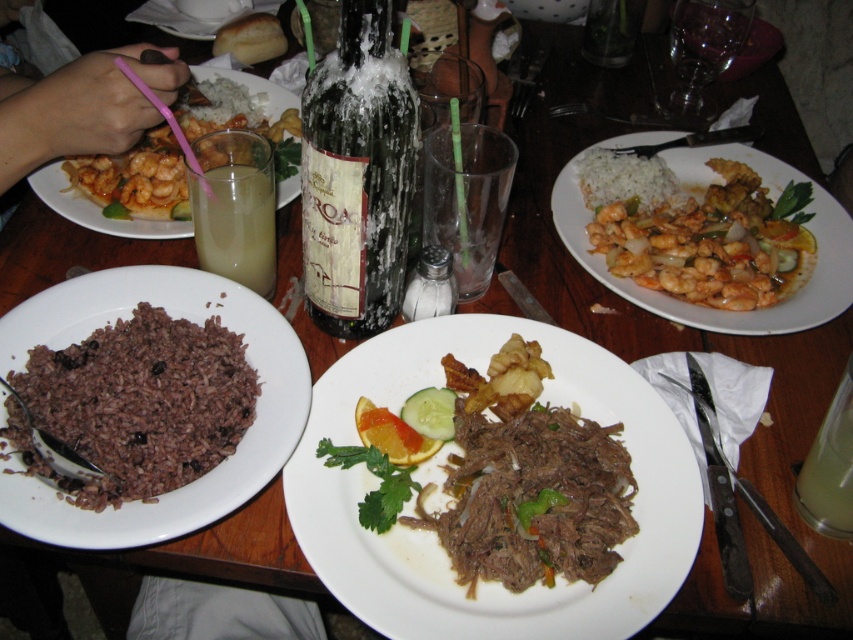
Can you confirm if shiny orange shrimp at upper left is bigger than bread at center?

Yes, shiny orange shrimp at upper left is bigger than bread at center.

Based on the photo, is shiny orange shrimp at upper left positioned before bread at center?

Yes, it is in front of bread at center.

Is point (279, 106) less distant than point (271, 36)?

Yes, it is in front of point (271, 36).

Where is `shiny orange shrimp at upper left`? shiny orange shrimp at upper left is located at coordinates (135, 177).

The height and width of the screenshot is (640, 853). In order to click on dark glass bottle at center in this screenshot , I will do `click(357, 176)`.

From the picture: Between dark glass bottle at center and shiny orange shrimp at right, which one is positioned lower?

Positioned lower is shiny orange shrimp at right.

This screenshot has height=640, width=853. Describe the element at coordinates (357, 176) in the screenshot. I see `dark glass bottle at center` at that location.

Identify the location of dark glass bottle at center. (357, 176).

Image resolution: width=853 pixels, height=640 pixels. Identify the location of shiny orange shrimp at upper left. (135, 177).

Based on the photo, who is more forward, (276, 168) or (842, 456)?

Point (842, 456) is more forward.

Who is more forward, (184, 129) or (843, 518)?

Positioned in front is point (843, 518).

Locate an element on the screen. The height and width of the screenshot is (640, 853). shiny orange shrimp at upper left is located at coordinates click(x=135, y=177).